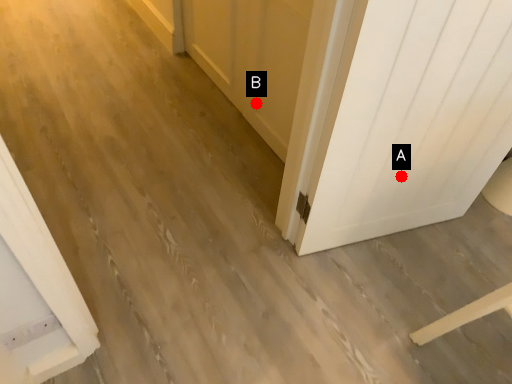
Question: Two points are circled on the image, labeled by A and B beside each circle. Among these points, which one is farthest from the camera?

Choices:
 (A) A is further
 (B) B is further

Answer: (B)